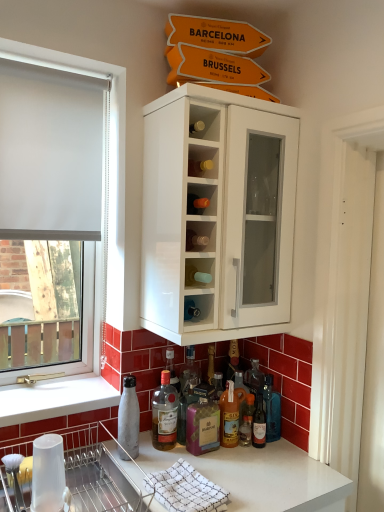
Question: Is point (61, 433) closer or farther from the camera than point (216, 432)?

Choices:
 (A) farther
 (B) closer

Answer: (B)

Question: Considering the positions of metallic silver dish rack at lower left and purple glass bottle at center, positioned as the 5th bottle in right-to-left order, in the image, is metallic silver dish rack at lower left taller or shorter than purple glass bottle at center, positioned as the 5th bottle in right-to-left order,?

Choices:
 (A) tall
 (B) short

Answer: (B)

Question: Which object is the closest to the translucent glass bottle at lower center, which is the 1th bottle from right to left?

Choices:
 (A) purple glass bottle at center, which ranks as the 2th bottle in left-to-right order
 (B) translucent glass bottle at lower center, which is the 3th bottle in left-to-right order
 (C) white glossy cabinet at upper center
 (D) white matte window at left
 (E) translucent glass bottle at lower center

Answer: (B)

Question: Which of these objects is positioned farthest from the translucent glass bottle at lower center, the fifth bottle positioned from the left?

Choices:
 (A) translucent glass bottle at lower center, which is the third bottle in right-to-left order
 (B) white wood screen door at right
 (C) translucent glass bottle at lower center, the sixth bottle when ordered from left to right
 (D) white glossy cabinet at upper center
 (E) translucent glass bottle at lower center, which is the 3th bottle in left-to-right order

Answer: (D)